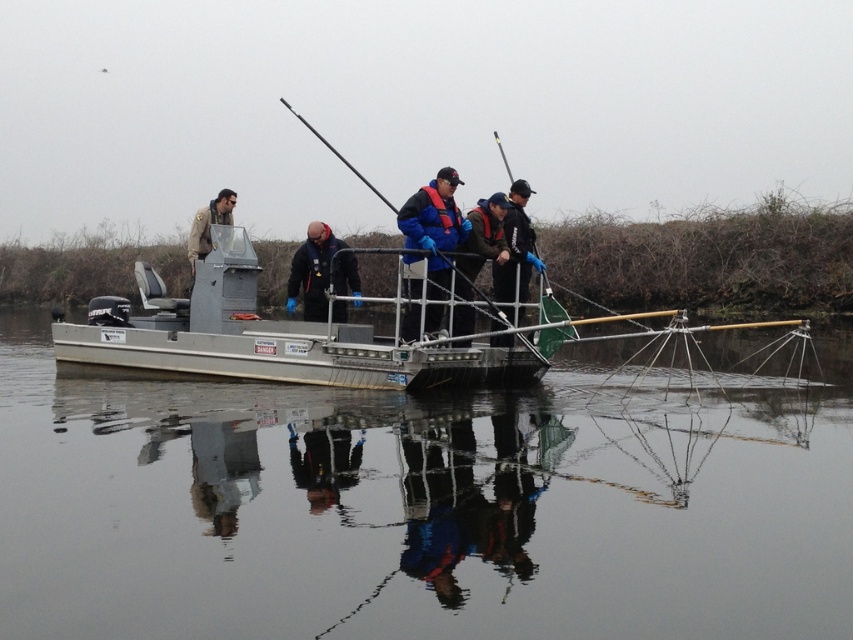
Measure the distance between silver metallic boat at center and blue rubber gloves at center.

silver metallic boat at center is 10.40 feet from blue rubber gloves at center.

Is point (239, 282) positioned behind point (492, 273)?

That is False.

At what (x,y) coordinates should I click in order to perform the action: click on silver metallic boat at center. Please return your answer as a coordinate pair (x, y). This screenshot has width=853, height=640. Looking at the image, I should click on (264, 337).

Does smooth gray water at center have a smaller size compared to blue rubber gloves at center?

No.

Where is `smooth gray water at center`? The width and height of the screenshot is (853, 640). smooth gray water at center is located at coordinates (416, 508).

Is the position of smooth gray water at center more distant than that of metallic fishing pole at center?

No.

Does point (827, 556) come behind point (351, 170)?

No, it is in front of (351, 170).

The height and width of the screenshot is (640, 853). Find the location of `smooth gray water at center`. smooth gray water at center is located at coordinates (416, 508).